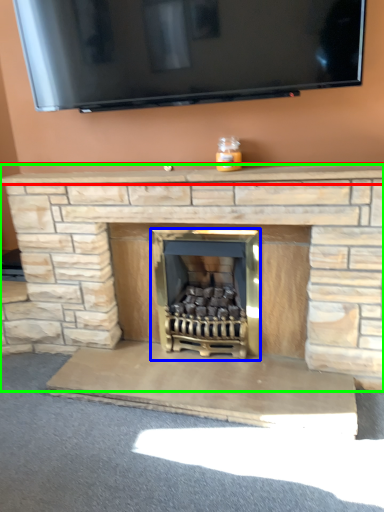
Question: Estimate the real-world distances between objects in this image. Which object is closer to mantle (highlighted by a red box), wood burning stove (highlighted by a blue box) or fireplace (highlighted by a green box)?

Choices:
 (A) wood burning stove
 (B) fireplace

Answer: (B)